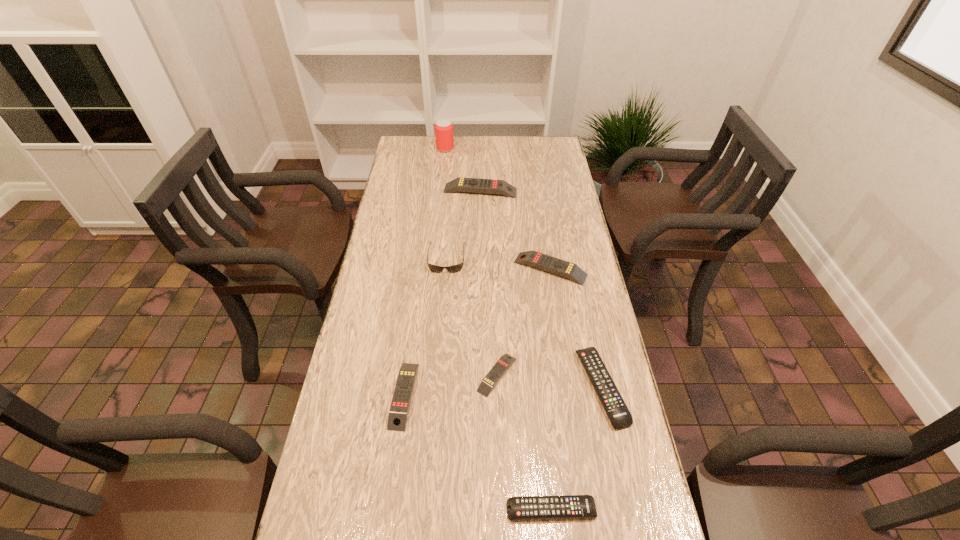
The height and width of the screenshot is (540, 960). Identify the location of beer can. (444, 136).

Where is `the tallest object`? This screenshot has width=960, height=540. the tallest object is located at coordinates (444, 136).

Find the location of a particular element. This screenshot has width=960, height=540. the farthest yellow remote control is located at coordinates (475, 185).

You are a GUI agent. You are given a task and a screenshot of the screen. Output one action in this format:
    pyautogui.click(x=<x>, y=<y>)
    Task: Click on the farthest remote control
    
    Given the screenshot: What is the action you would take?
    pyautogui.click(x=475, y=185)

In order to click on sunglasses in this screenshot , I will do `click(434, 268)`.

The width and height of the screenshot is (960, 540). I want to click on the fifth shortest remote control, so click(x=563, y=268).

Where is `the third nearest yellow remote control`? This screenshot has width=960, height=540. the third nearest yellow remote control is located at coordinates (563, 268).

Image resolution: width=960 pixels, height=540 pixels. Find the location of `the leftmost yellow remote control`. the leftmost yellow remote control is located at coordinates (397, 419).

Locate an element on the screen. the second smallest yellow remote control is located at coordinates (397, 419).

Locate an element on the screen. The height and width of the screenshot is (540, 960). the bigger black remote control is located at coordinates (619, 415).